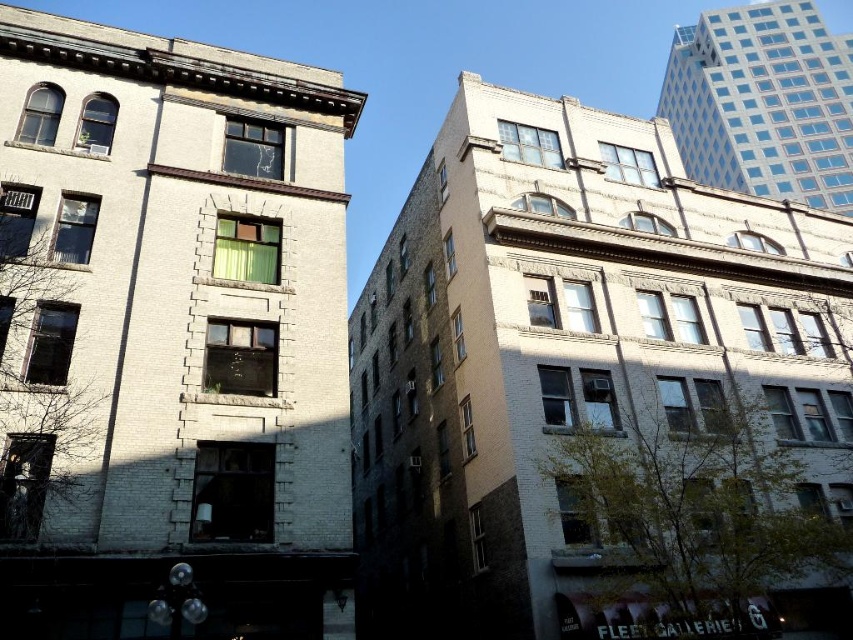
Question: Which object appears farthest from the camera in this image?

Choices:
 (A) white brick building at left
 (B) white brick building at center

Answer: (B)

Question: Is white brick building at left wider than white brick building at center?

Choices:
 (A) no
 (B) yes

Answer: (A)

Question: Is white brick building at left thinner than white brick building at center?

Choices:
 (A) yes
 (B) no

Answer: (A)

Question: Which point is farther to the camera?

Choices:
 (A) (538, 422)
 (B) (283, 257)

Answer: (A)

Question: Is white brick building at left smaller than white brick building at center?

Choices:
 (A) no
 (B) yes

Answer: (B)

Question: Which of the following is the closest to the observer?

Choices:
 (A) white brick building at center
 (B) white brick building at left

Answer: (B)